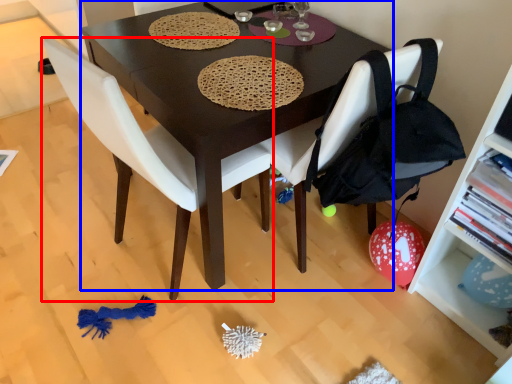
Question: Which of the following is the closest to the observer, chair (highlighted by a red box) or desk (highlighted by a blue box)?

Choices:
 (A) chair
 (B) desk

Answer: (A)